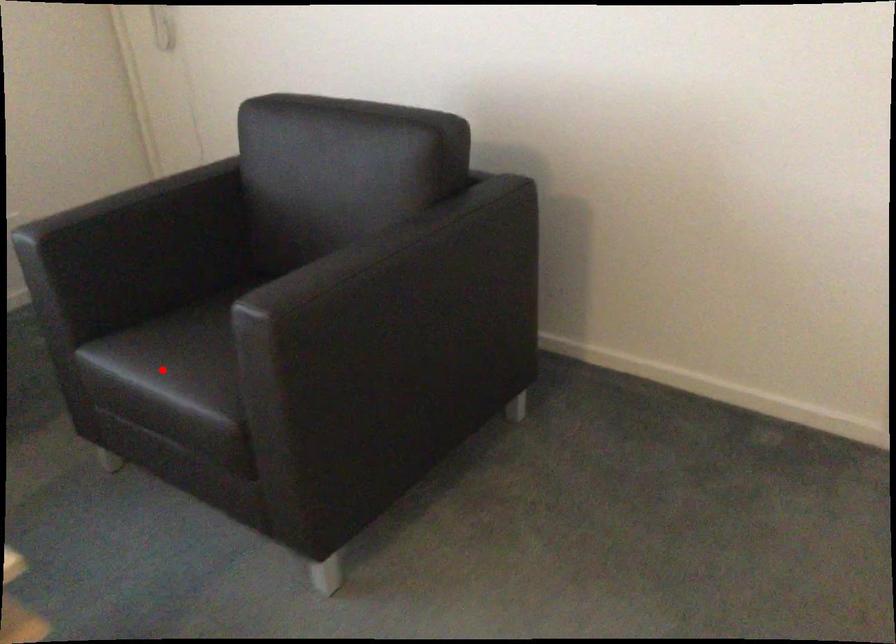
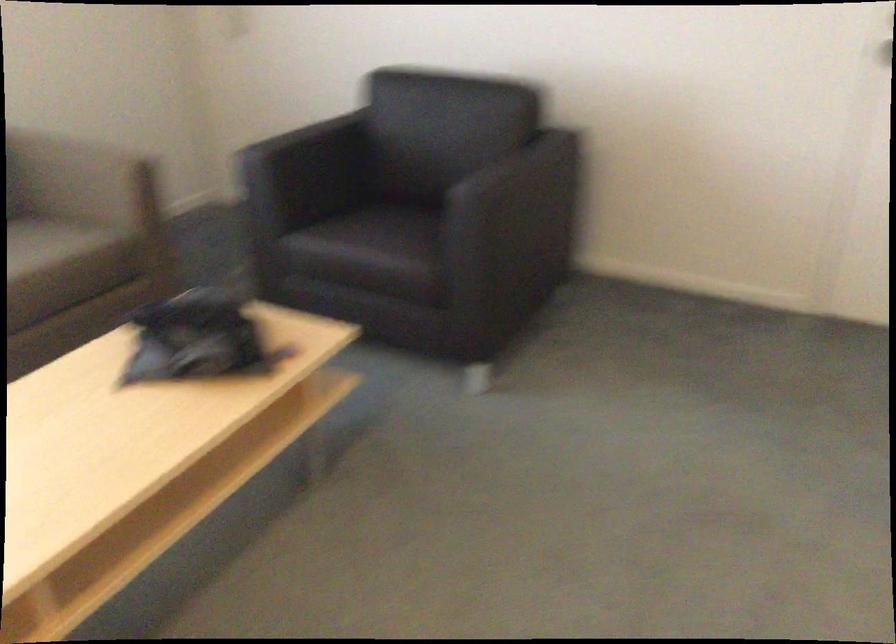
Question: I am providing you with two images of the same scene from different viewpoints. A red point is marked on the first image. At the location where the point appears in image 1, is it still visible in image 2?

Choices:
 (A) Yes
 (B) No

Answer: (A)